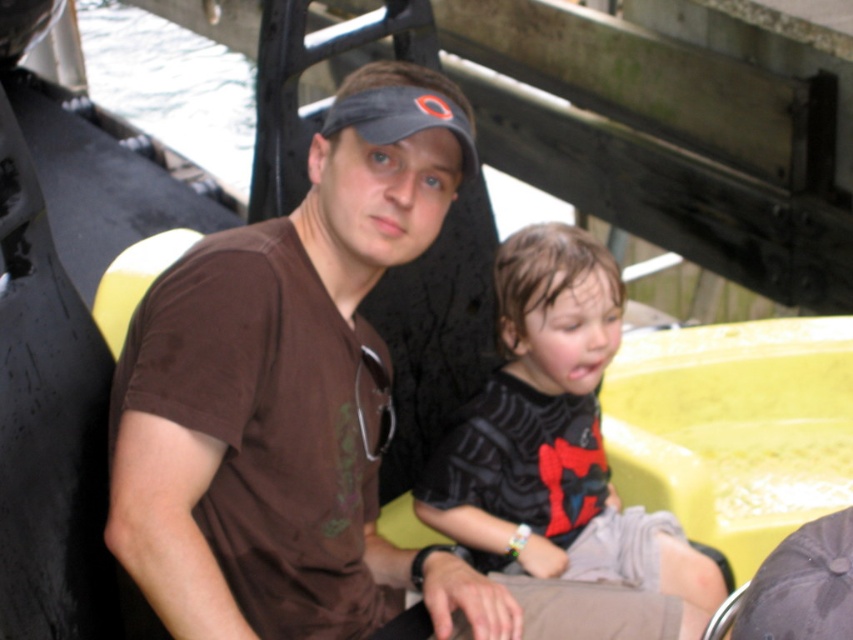
Question: Is the position of brown matte t-shirt at center less distant than that of black matte shirt at center?

Choices:
 (A) no
 (B) yes

Answer: (B)

Question: Which object appears closest to the camera in this image?

Choices:
 (A) black matte shirt at center
 (B) brown matte t-shirt at center

Answer: (B)

Question: Can you confirm if brown matte t-shirt at center is bigger than black matte shirt at center?

Choices:
 (A) no
 (B) yes

Answer: (B)

Question: Which object is closer to the camera taking this photo?

Choices:
 (A) black matte shirt at center
 (B) brown matte t-shirt at center

Answer: (B)

Question: Can you confirm if brown matte t-shirt at center is wider than black matte shirt at center?

Choices:
 (A) no
 (B) yes

Answer: (A)